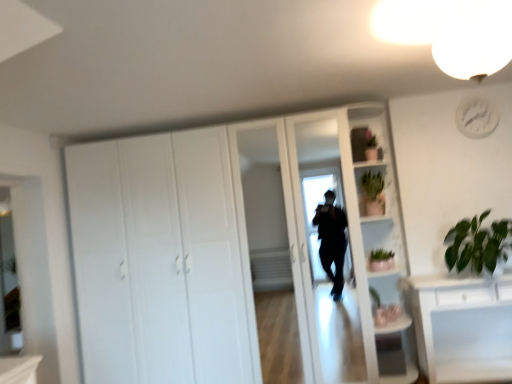
Image resolution: width=512 pixels, height=384 pixels. Describe the element at coordinates (371, 189) in the screenshot. I see `green matte cactus at upper right, the second cabinet positioned from the top` at that location.

Measure the distance between white glossy light fixture at upper right and camera.

white glossy light fixture at upper right is 1.68 meters from camera.

The width and height of the screenshot is (512, 384). Find the location of `white plastic clock at upper right`. white plastic clock at upper right is located at coordinates (476, 118).

Based on the photo, considering the relative positions of white matte cupboard at center and white glossy light fixture at upper right in the image provided, is white matte cupboard at center behind white glossy light fixture at upper right?

Yes, white matte cupboard at center is behind white glossy light fixture at upper right.

Which of these two, white matte cupboard at center or white glossy light fixture at upper right, is wider?

With larger width is white matte cupboard at center.

Who is smaller, white matte cupboard at center or white glossy light fixture at upper right?

white glossy light fixture at upper right.

From the picture: Which of these two, clear glass mirror at left or white glossy light fixture at upper right, stands taller?

Standing taller between the two is clear glass mirror at left.

Which is further, (0, 348) or (501, 21)?

Positioned behind is point (0, 348).

Considering the relative sizes of clear glass mirror at left and white glossy light fixture at upper right in the image provided, is clear glass mirror at left wider than white glossy light fixture at upper right?

Incorrect, the width of clear glass mirror at left does not surpass that of white glossy light fixture at upper right.

Consider the image. Based on their sizes in the image, would you say clear glass mirror at left is bigger or smaller than white glossy light fixture at upper right?

clear glass mirror at left is smaller than white glossy light fixture at upper right.

Which is closer, [369,338] or [377,195]?

Positioned in front is point [369,338].

From the picture: From a real-world perspective, which is physically below, white matte cupboard at center or green matte cactus at upper right, the first cabinet viewed from the back?

In real-world perspective, white matte cupboard at center is lower.

Is white matte cupboard at center behind green matte cactus at upper right, the 2th cabinet in the front-to-back sequence?

No.

Does green leafy plant at right have a lesser height compared to white glossy light fixture at upper right?

No.

Which is correct: green leafy plant at right is inside white glossy light fixture at upper right, or outside of it?

green leafy plant at right is not inside white glossy light fixture at upper right, it's outside.

Considering the relative positions of green leafy plant at right and white glossy light fixture at upper right in the image provided, is green leafy plant at right to the left of white glossy light fixture at upper right from the viewer's perspective?

Incorrect, green leafy plant at right is not on the left side of white glossy light fixture at upper right.

Which of these two, green leafy plant at right or white glossy light fixture at upper right, is thinner?

white glossy light fixture at upper right.

Is green matte plant at upper right, the second cabinet ordered from the bottom, wider or thinner than white matte cupboard at center?

green matte plant at upper right, the second cabinet ordered from the bottom, is thinner than white matte cupboard at center.

Between green matte plant at upper right, which is the first cabinet from top to bottom, and white matte cupboard at center, which one has smaller size?

Smaller between the two is green matte plant at upper right, which is the first cabinet from top to bottom.

From the image's perspective, between green matte plant at upper right, the second cabinet ordered from the bottom, and white matte cupboard at center, who is located below?

white matte cupboard at center is shown below in the image.

Is point (412, 364) in front of point (372, 258)?

That is True.

Does white glossy bookshelf at upper right appear on the left side of green matte plant at right?

Indeed, white glossy bookshelf at upper right is positioned on the left side of green matte plant at right.

Is the surface of green matte plant at right in direct contact with clear glass mirror at left?

No, green matte plant at right is not with clear glass mirror at left.

How much distance is there between green matte plant at right and clear glass mirror at left?

They are 3.03 meters apart.

From the image's perspective, which one is positioned higher, green matte plant at right or clear glass mirror at left?

From the image's view, clear glass mirror at left is above.

Considering the sizes of objects green matte plant at right and clear glass mirror at left in the image provided, who is smaller, green matte plant at right or clear glass mirror at left?

With smaller size is green matte plant at right.

Image resolution: width=512 pixels, height=384 pixels. I want to click on cupboard beneath the white glossy light fixture at upper right (from a real-world perspective), so click(227, 251).

The height and width of the screenshot is (384, 512). I want to click on light fixture that is above the clear glass mirror at left (from a real-world perspective), so click(x=475, y=39).

Which object lies nearer to the anchor point green leafy plant at right, green matte cactus at upper right, placed as the first cabinet when sorted from bottom to top, or white glossy light fixture at upper right?

Based on the image, green matte cactus at upper right, placed as the first cabinet when sorted from bottom to top, appears to be nearer to green leafy plant at right.

From the image, which object appears to be farther from white matte cupboard at center, green matte plant at right or green leafy plant at right?

green leafy plant at right.

When comparing their distances from white plastic clock at upper right, does white glossy bookshelf at upper right or green matte plant at right seem closer?

The object closer to white plastic clock at upper right is white glossy bookshelf at upper right.

When comparing their distances from white glossy light fixture at upper right, does clear glass mirror at left or green matte cactus at upper right, placed as the first cabinet when sorted from bottom to top, seem further?

clear glass mirror at left is further to white glossy light fixture at upper right.

Which object lies further to the anchor point green matte plant at right, green leafy plant at right or white glossy light fixture at upper right?

Based on the image, white glossy light fixture at upper right appears to be further to green matte plant at right.

Estimate the real-world distances between objects in this image. Which object is closer to white glossy bookshelf at upper right, white glossy light fixture at upper right or white plastic clock at upper right?

white plastic clock at upper right is closer to white glossy bookshelf at upper right.

Which object lies further to the anchor point green leafy plant at right, white matte cupboard at center or green matte cactus at upper right, the 2th cabinet in the front-to-back sequence?

The object further to green leafy plant at right is white matte cupboard at center.

Which object lies further to the anchor point white glossy light fixture at upper right, green matte cactus at upper right, placed as the first cabinet when sorted from bottom to top, or green matte plant at right?

The object further to white glossy light fixture at upper right is green matte plant at right.

You are a GUI agent. You are given a task and a screenshot of the screen. Output one action in this format:
    pyautogui.click(x=<x>, y=<y>)
    Task: Click on the houseplant between green matte plant at upper right, the 1th cabinet viewed from the front, and green matte plant at right, in the vertical direction
    Image resolution: width=512 pixels, height=384 pixels.
    Given the screenshot: What is the action you would take?
    pyautogui.click(x=478, y=244)

Image resolution: width=512 pixels, height=384 pixels. In order to click on houseplant between white plastic clock at upper right and green matte plant at right in the vertical direction in this screenshot , I will do [478, 244].

This screenshot has height=384, width=512. Identify the location of bookshelf between clear glass mirror at left and white plastic clock at upper right. [378, 237].

Find the location of a particular element. Image resolution: width=512 pixels, height=384 pixels. plant between white glossy bookshelf at upper right and green leafy plant at right from left to right is located at coordinates (381, 255).